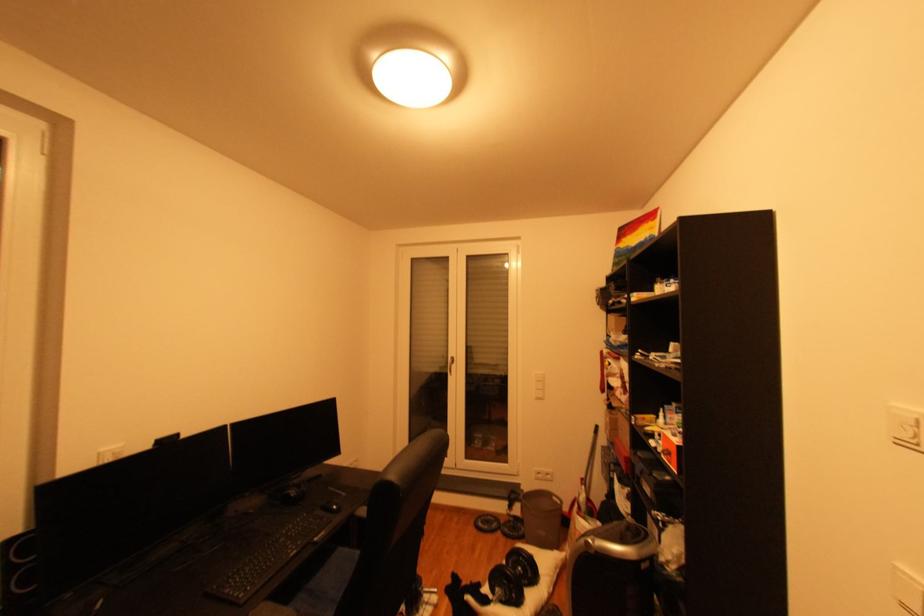
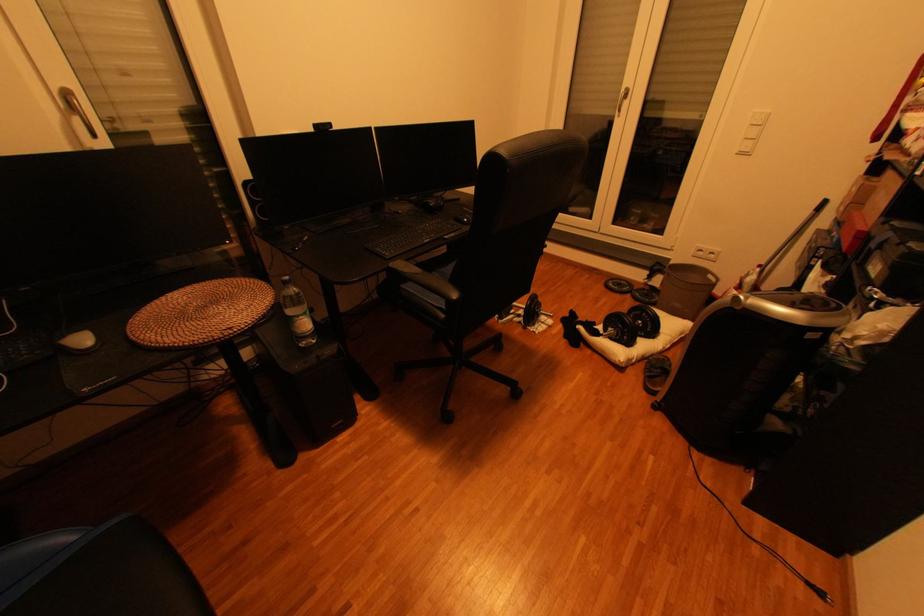
Find the pixel in the second image that matches (546,399) in the first image.

(749, 155)